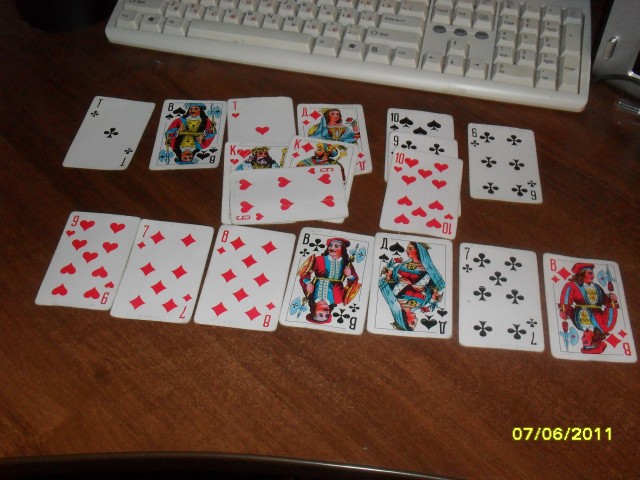
This screenshot has height=480, width=640. In order to click on wood table in this screenshot , I will do `click(36, 68)`, `click(33, 214)`, `click(38, 360)`, `click(200, 389)`, `click(417, 397)`, `click(586, 388)`, `click(593, 220)`, `click(604, 143)`.